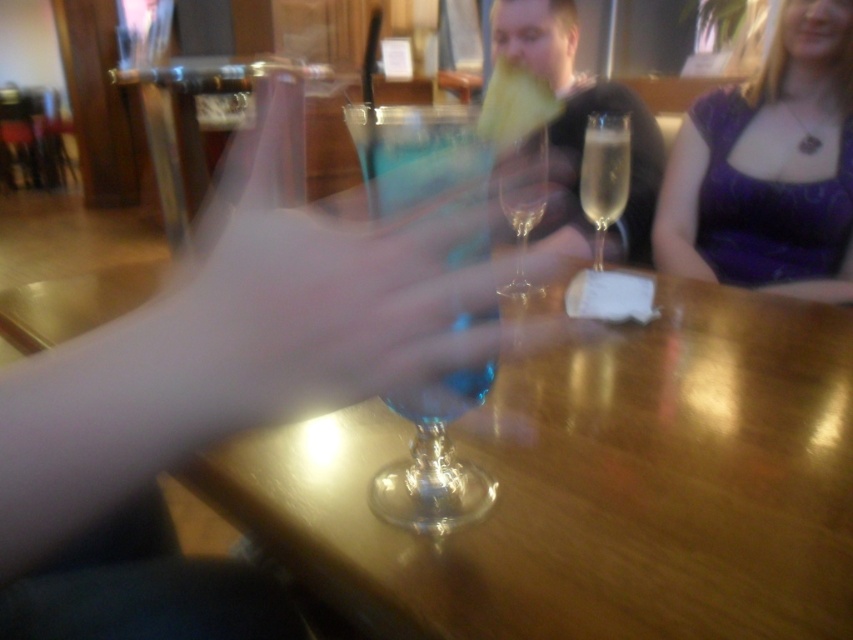
You are at a bar and want to grab the clear glass champagne flute at center without knocking over the transparent glass wine glass at center. Which direction should you reach to pick it up?

The transparent glass wine glass at center is to the left of the clear glass champagne flute at center, so you should reach to the right to pick up the clear glass champagne flute at center without disturbing the wine glass.

You are at a bar and want to grab the cocktail glass located at point (x=621, y=595). The bartender warns you that there is a fragile vase nearby. Can you safely reach the glass without touching the vase?

The point (x=621, y=595) is 16.46 inches away from the viewer, so you can safely reach the cocktail glass at that point without disturbing the fragile vase if it is positioned farther away. However, the exact location of the vase isn

What are the coordinates of the transparent glass wine glass at center?

The transparent glass wine glass at center is located at coordinates point (434, 461).